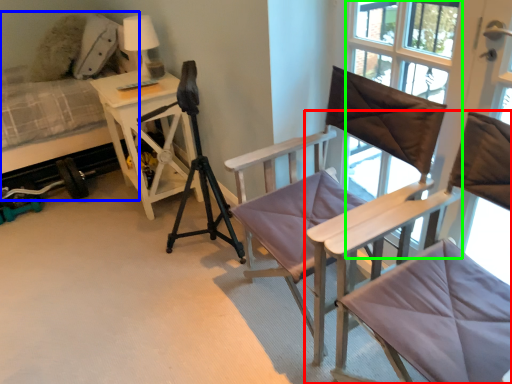
Question: Based on their relative distances, which object is farther from chair (highlighted by a red box)? Choose from hospital bed (highlighted by a blue box) and window screen (highlighted by a green box).

Choices:
 (A) hospital bed
 (B) window screen

Answer: (A)